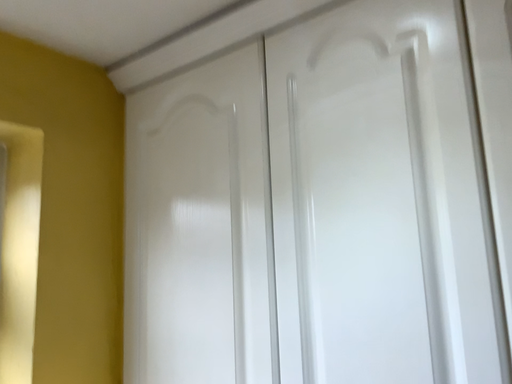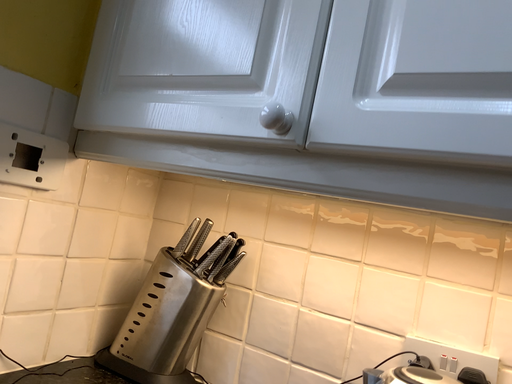
Question: How did the camera likely rotate when shooting the video?

Choices:
 (A) rotated downward
 (B) rotated upward

Answer: (A)